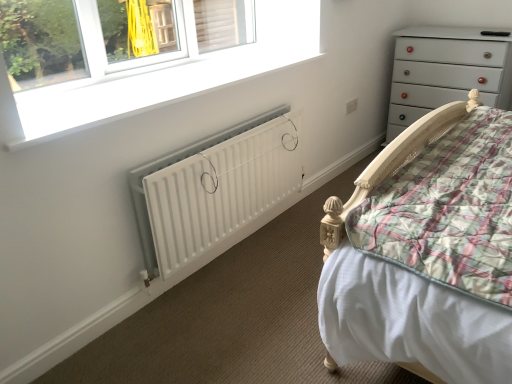
Question: Considering the positions of white matte window at upper left and white matte radiator at lower center in the image, is white matte window at upper left wider or thinner than white matte radiator at lower center?

Choices:
 (A) wide
 (B) thin

Answer: (A)

Question: Is white matte window at upper left spatially inside white matte radiator at lower center, or outside of it?

Choices:
 (A) outside
 (B) inside

Answer: (A)

Question: Which of these objects is positioned farthest from the white glossy chest of drawers at upper right?

Choices:
 (A) white matte window at upper left
 (B) white matte radiator at lower center

Answer: (B)

Question: Which object is the farthest from the white matte window at upper left?

Choices:
 (A) white glossy chest of drawers at upper right
 (B) white matte radiator at lower center

Answer: (A)